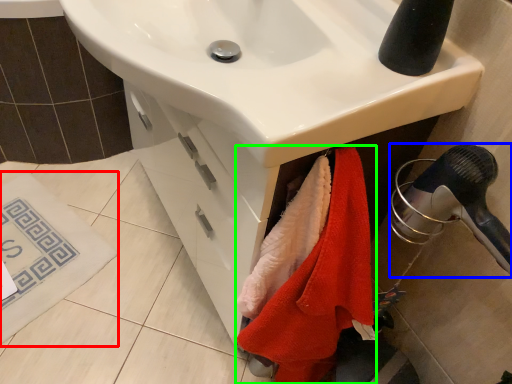
Question: Which object is the farthest from bath mat (highlighted by a red box)? Choose among these: hair drier (highlighted by a blue box) or beach towel (highlighted by a green box).

Choices:
 (A) hair drier
 (B) beach towel

Answer: (A)